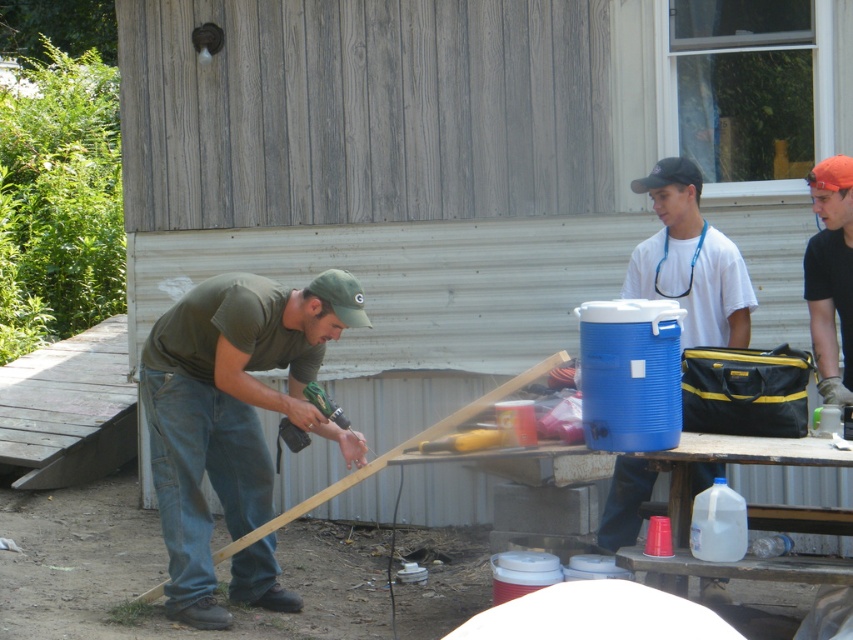
Is green matte shirt at center taller than orange fabric cap at upper right?

Yes.

Does green matte shirt at center have a larger size compared to orange fabric cap at upper right?

Correct, green matte shirt at center is larger in size than orange fabric cap at upper right.

Is point (164, 380) farther from viewer compared to point (819, 330)?

That is False.

The image size is (853, 640). Find the location of `green matte shirt at center`. green matte shirt at center is located at coordinates (231, 410).

Between green matte shirt at center and white matte cooler at center, which one has more height?

green matte shirt at center

Is green matte shirt at center above white matte cooler at center?

Actually, green matte shirt at center is below white matte cooler at center.

Measure the distance between point (173, 422) and camera.

Point (173, 422) is 7.74 meters from camera.

Locate an element on the screen. The height and width of the screenshot is (640, 853). green matte shirt at center is located at coordinates (x=231, y=410).

Is point (680, 298) positioned before point (846, 204)?

No, it is behind (846, 204).

Between point (631, 499) and point (809, 252), which one is positioned in front?

Point (809, 252) is more forward.

Between point (712, 260) and point (840, 268), which one is positioned in front?

Positioned in front is point (840, 268).

What are the coordinates of `white matte cooler at center` in the screenshot? It's located at (689, 260).